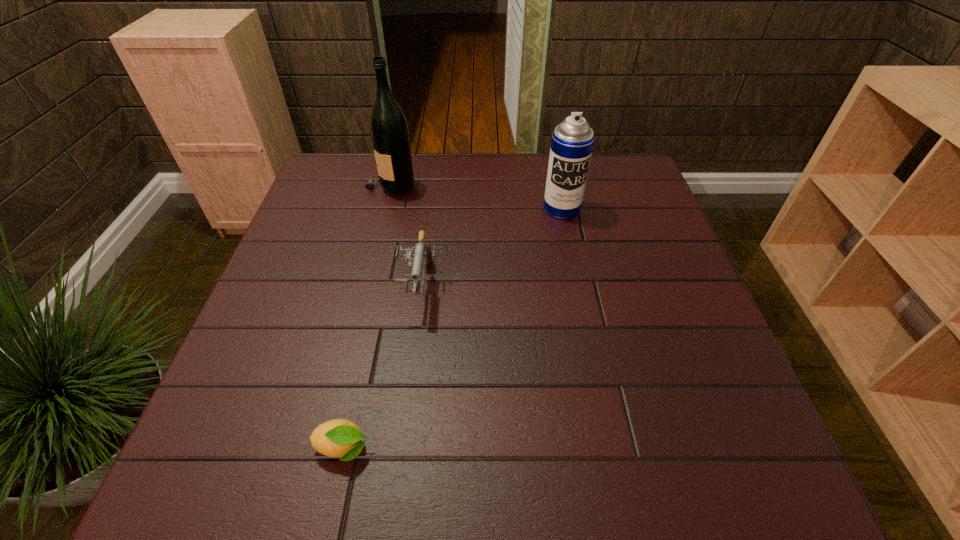
At what (x,y) coordinates should I click in order to perform the action: click on vacant position located 0.240m at the barrel end of the gun. Please return your answer as a coordinate pair (x, y). Image resolution: width=960 pixels, height=540 pixels. Looking at the image, I should click on (400, 421).

At what (x,y) coordinates should I click in order to perform the action: click on vacant space positioned with leaves positioned above the nearest object. Please return your answer as a coordinate pair (x, y). The width and height of the screenshot is (960, 540). Looking at the image, I should click on (554, 449).

This screenshot has width=960, height=540. In order to click on wine bottle that is at the far edge in this screenshot , I will do `click(389, 131)`.

Identify the location of aerosol can that is positioned at the far edge. This screenshot has height=540, width=960. (572, 141).

Where is `object located in the near edge section of the desktop`? object located in the near edge section of the desktop is located at coordinates (341, 438).

At what (x,y) coordinates should I click in order to perform the action: click on object that is at the left edge. Please return your answer as a coordinate pair (x, y). The image size is (960, 540). Looking at the image, I should click on (389, 131).

The image size is (960, 540). What are the coordinates of `object located at the far left corner` in the screenshot? It's located at (389, 131).

Where is `free space at the far edge of the desktop`? The height and width of the screenshot is (540, 960). free space at the far edge of the desktop is located at coordinates (479, 184).

The image size is (960, 540). In order to click on free space at the left edge of the desktop in this screenshot , I will do `click(345, 235)`.

The image size is (960, 540). In the image, there is a desktop. What are the coordinates of `free space at the right edge` in the screenshot? It's located at (727, 399).